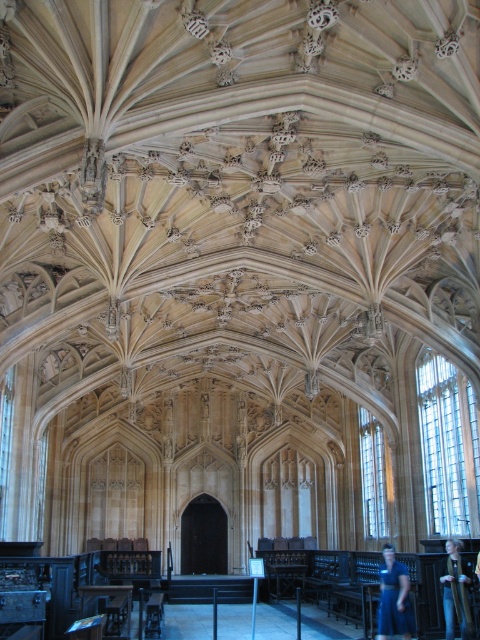
You are standing in the grand historic building and looking at the ceiling. There are two points marked on the ceiling, point 1 at coordinates point (x=394, y=564) and point 2 at coordinates point (x=470, y=621). Which point is closer to you?

Point (x=394, y=564) is further to the camera than point (x=470, y=621), so point (x=470, y=621) is closer to you.